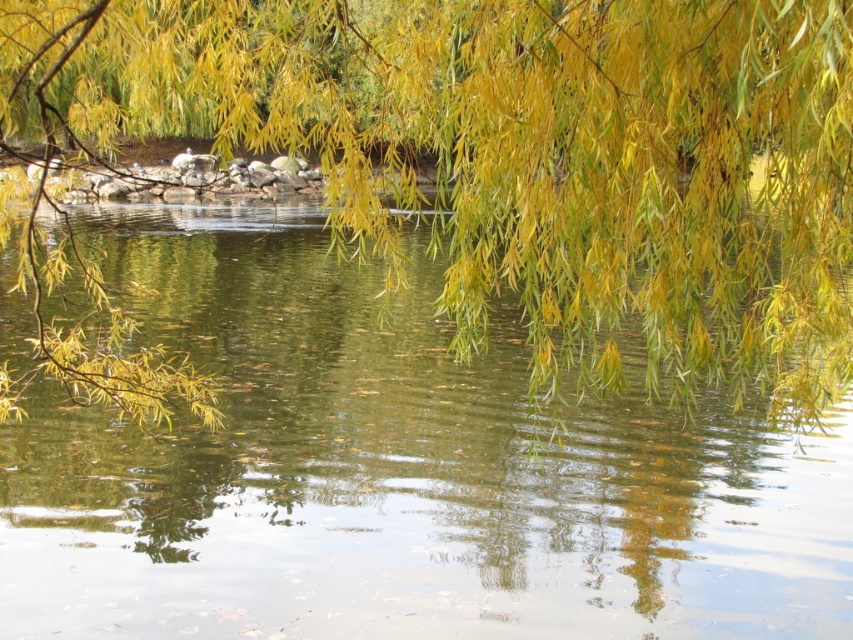
Question: Which point appears closest to the camera in this image?

Choices:
 (A) (367, 129)
 (B) (355, 275)

Answer: (A)

Question: Is green reflective water at center above yellow-green leafy branches at upper center?

Choices:
 (A) no
 (B) yes

Answer: (B)

Question: Does green reflective water at center lie in front of yellow-green leafy branches at upper center?

Choices:
 (A) no
 (B) yes

Answer: (A)

Question: Can you confirm if green reflective water at center is positioned to the right of yellow-green leafy branches at upper center?

Choices:
 (A) yes
 (B) no

Answer: (B)

Question: Among these points, which one is nearest to the camera?

Choices:
 (A) (68, 460)
 (B) (596, 97)

Answer: (B)